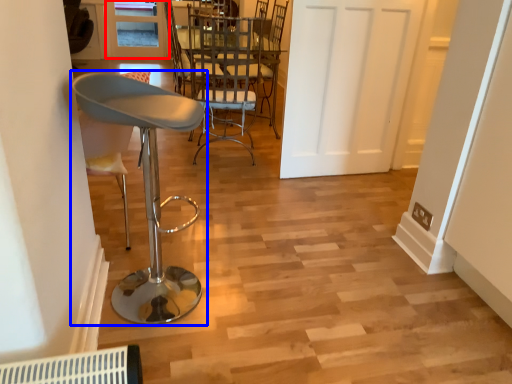
Question: Which point is closer to the camera, window (highlighted by a red box) or chair (highlighted by a blue box)?

Choices:
 (A) window
 (B) chair

Answer: (B)